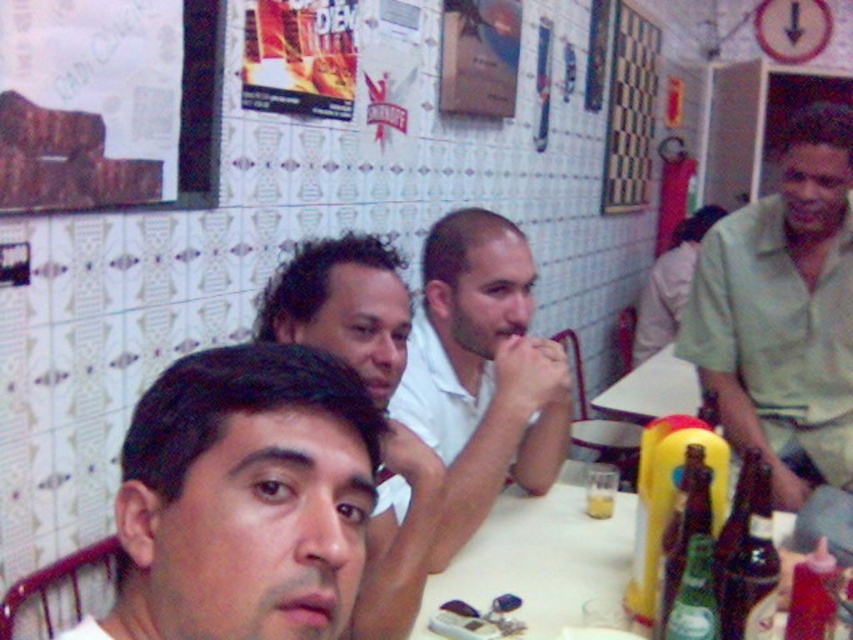
Measure the distance between smooth skin face at center and green cotton shirt at right.

smooth skin face at center and green cotton shirt at right are 5.01 feet apart.

Is point (334, 396) positioned behind point (838, 259)?

That is False.

Does point (161, 632) come closer to viewer compared to point (770, 424)?

Yes.

Identify the location of smooth skin face at center. (242, 499).

Who is positioned more to the left, smooth skin face at center or checkerboard pattern at upper right?

From the viewer's perspective, smooth skin face at center appears more on the left side.

Locate an element on the screen. smooth skin face at center is located at coordinates (242, 499).

Locate an element on the screen. This screenshot has width=853, height=640. smooth skin face at center is located at coordinates (242, 499).

Who is positioned more to the right, green glass bottles at lower center or white plastic table at center?

From the viewer's perspective, white plastic table at center appears more on the right side.

Find the location of a particular element. Image resolution: width=853 pixels, height=640 pixels. green glass bottles at lower center is located at coordinates (543, 563).

This screenshot has width=853, height=640. I want to click on green glass bottles at lower center, so [543, 563].